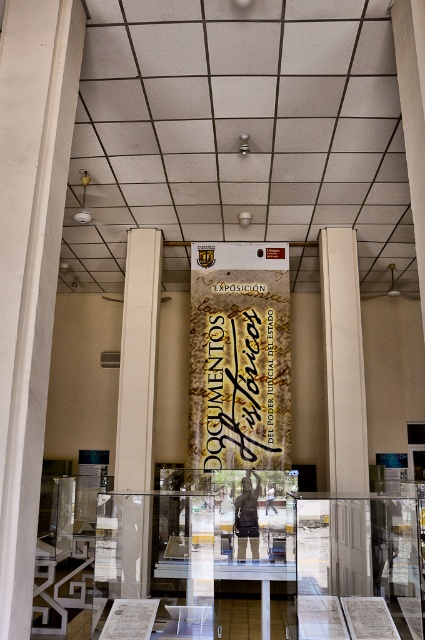
You are a visitor in this museum and want to take a photo of the gold calligraphy banner at center without the beige concrete pillar at center blocking the view. Is it possible to position yourself in such a way that the banner is visible but the pillar is not?

The beige concrete pillar at center is thinner than the gold calligraphy banner at center, so if you position yourself to the side of the pillar, you can see the wider banner while avoiding the pillar blocking the view.